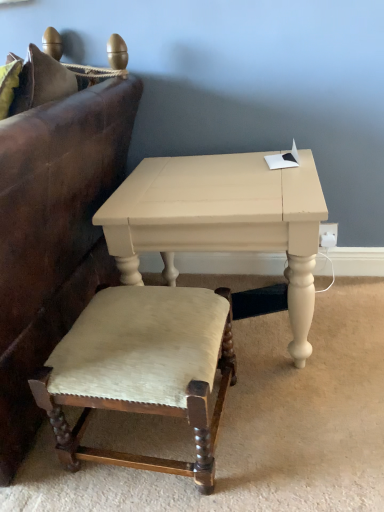
Find the location of a particular element. vacant area that lies to the right of matte white table at center is located at coordinates (345, 321).